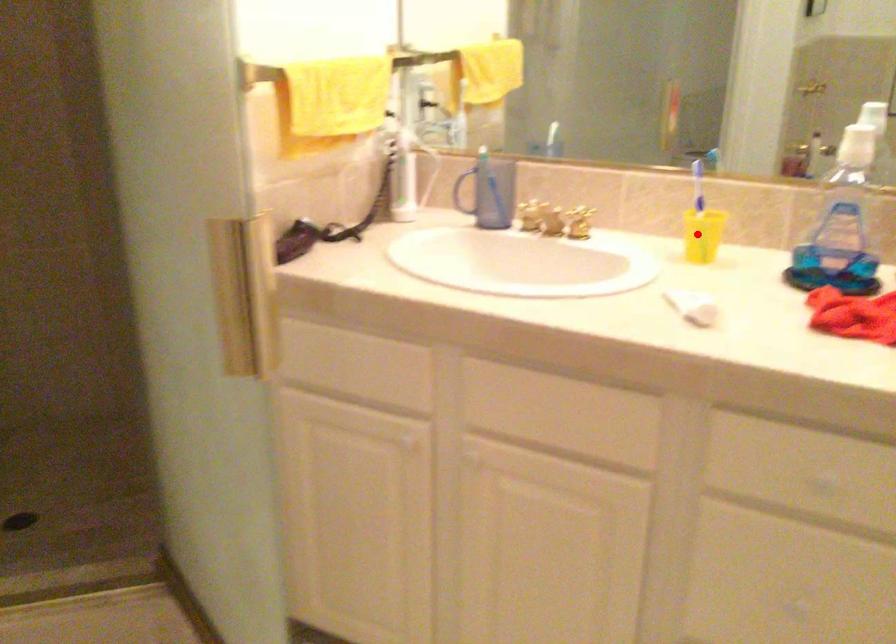
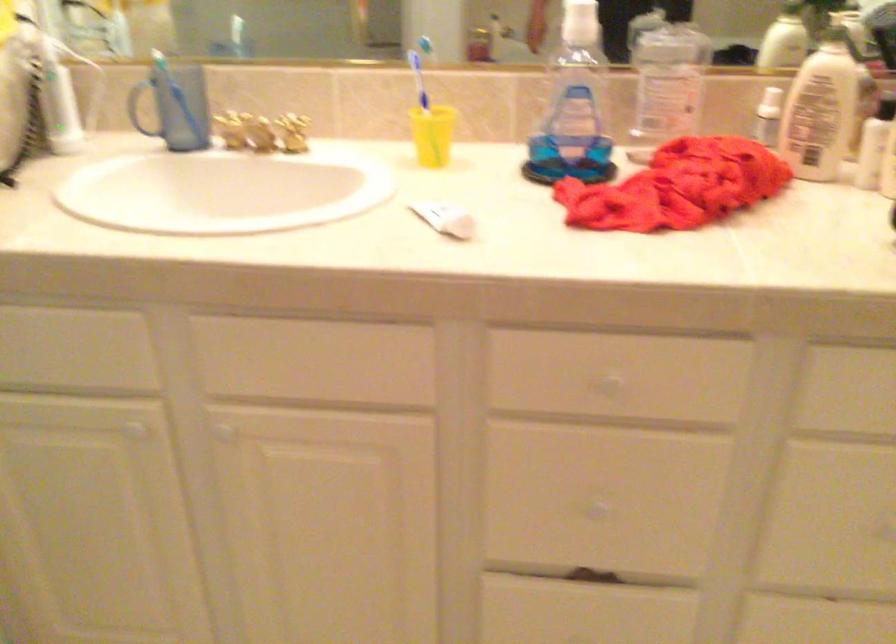
Question: I am providing you with two images of the same scene from different viewpoints. A red point is marked on the first image. At the location where the point appears in image 1, is it still visible in image 2?

Choices:
 (A) Yes
 (B) No

Answer: (A)